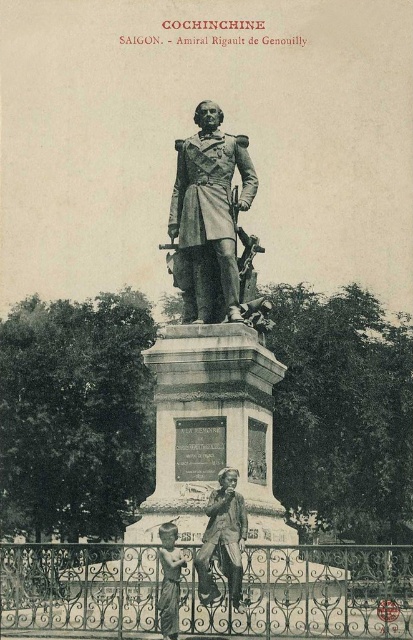
Which of these two, matte bronze statue at center or matte bronze statue at lower center, stands shorter?

With less height is matte bronze statue at center.

Who is more forward, [223,470] or [161,538]?

Point [161,538] is in front.

The width and height of the screenshot is (413, 640). What are the coordinates of `matte bronze statue at center` in the screenshot? It's located at (223, 540).

Who is positioned more to the left, wrought iron fence at lower center or matte bronze statue at center?

matte bronze statue at center

Based on the photo, is wrought iron fence at lower center positioned before matte bronze statue at center?

Yes, it is in front of matte bronze statue at center.

Does point (123, 620) come farther from viewer compared to point (206, 580)?

Yes.

Identify the location of wrought iron fence at lower center. The image size is (413, 640). (310, 593).

Can you confirm if wrought iron fence at lower center is positioned to the left of bronze statue at center?

No, wrought iron fence at lower center is not to the left of bronze statue at center.

Can you confirm if wrought iron fence at lower center is wider than bronze statue at center?

Yes.

Is point (348, 577) positioned in front of point (190, 140)?

That is True.

At what (x,y) coordinates should I click in order to perform the action: click on wrought iron fence at lower center. Please return your answer as a coordinate pair (x, y). The height and width of the screenshot is (640, 413). Looking at the image, I should click on (310, 593).